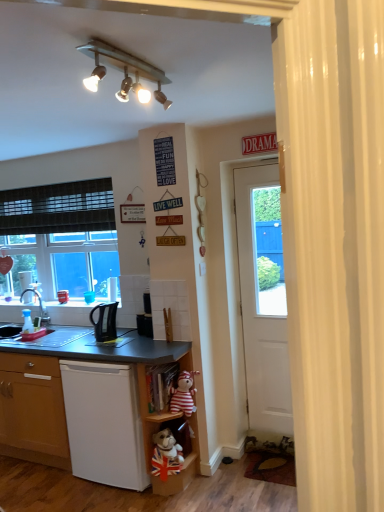
Identify the location of vacant space in between wooden shelf at lower center, arranged as the second shelf when ordered from the bottom, and brown textured rug at lower right. (230, 479).